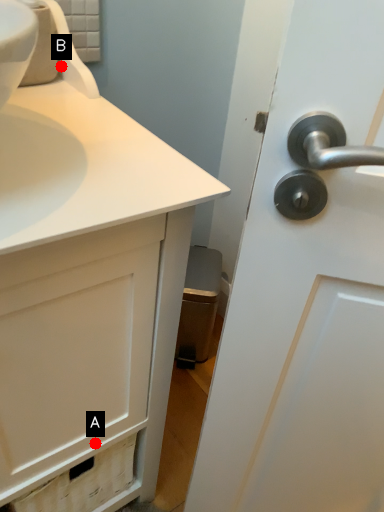
Question: Two points are circled on the image, labeled by A and B beside each circle. Among these points, which one is farthest from the camera?

Choices:
 (A) A is further
 (B) B is further

Answer: (B)